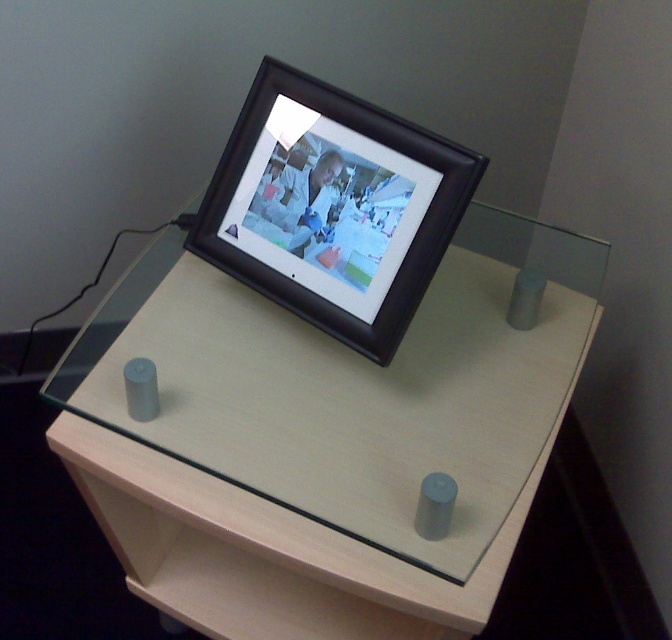
Question: Is light wood computer desk at center smaller than black matte picture frame at center?

Choices:
 (A) yes
 (B) no

Answer: (B)

Question: Which of the following is the closest to the observer?

Choices:
 (A) (168, 464)
 (B) (384, 131)

Answer: (B)

Question: Which of the following is the closest to the observer?

Choices:
 (A) black matte picture frame at center
 (B) light wood computer desk at center

Answer: (B)

Question: Which point is farther to the camera?

Choices:
 (A) (386, 326)
 (B) (284, 340)

Answer: (B)

Question: In this image, where is light wood computer desk at center located relative to black matte picture frame at center?

Choices:
 (A) left
 (B) right

Answer: (A)

Question: Can you confirm if light wood computer desk at center is positioned above black matte picture frame at center?

Choices:
 (A) yes
 (B) no

Answer: (B)